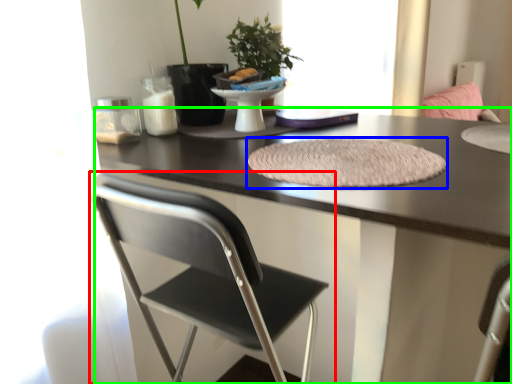
Question: Which is nearer to the chair (highlighted by a red box)? mat (highlighted by a blue box) or desk (highlighted by a green box).

Choices:
 (A) mat
 (B) desk

Answer: (B)